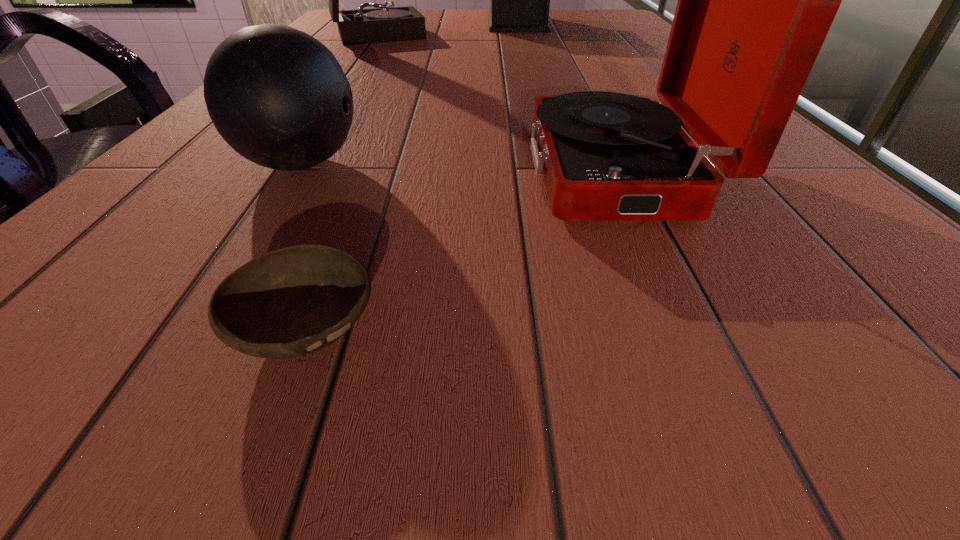
The image size is (960, 540). In order to click on vacant space located 0.330m on the front-facing side of the nearest phonograph_record in this screenshot , I will do `click(293, 172)`.

Identify the location of free space located on the front-facing side of the nearest phonograph_record. The image size is (960, 540). (482, 172).

This screenshot has height=540, width=960. I want to click on blank space located on the front-facing side of the nearest phonograph_record, so click(431, 172).

This screenshot has width=960, height=540. Find the location of `blank area located 0.390m on the grip area of the bowling ball`. blank area located 0.390m on the grip area of the bowling ball is located at coordinates (637, 164).

You are a GUI agent. You are given a task and a screenshot of the screen. Output one action in this format:
    pyautogui.click(x=<x>, y=<y>)
    Task: Click on the vacant area located on the left of the shortest object
    The height and width of the screenshot is (540, 960).
    Given the screenshot: What is the action you would take?
    pyautogui.click(x=179, y=328)

You are a GUI agent. You are given a task and a screenshot of the screen. Output one action in this format:
    pyautogui.click(x=<x>, y=<y>)
    Task: Click on the object at the near edge
    This screenshot has height=540, width=960.
    Given the screenshot: What is the action you would take?
    pyautogui.click(x=290, y=302)

I want to click on phonograph record that is at the left edge, so click(x=362, y=26).

You are a GUI agent. You are given a task and a screenshot of the screen. Output one action in this format:
    pyautogui.click(x=<x>, y=<y>)
    Task: Click on the bowling ball present at the left edge
    The width and height of the screenshot is (960, 540).
    Given the screenshot: What is the action you would take?
    pyautogui.click(x=278, y=96)

Identify the location of object located in the right edge section of the desktop. (756, 0).

Locate an element on the screen. Image resolution: width=960 pixels, height=540 pixels. object located at the far left corner is located at coordinates (362, 26).